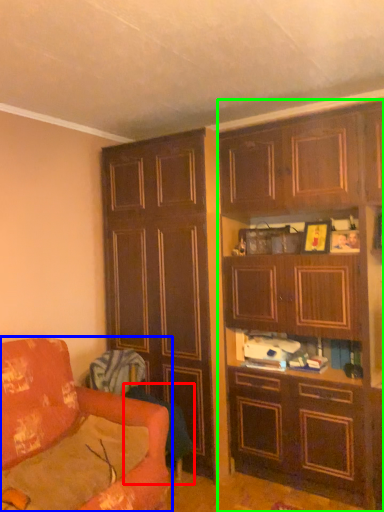
Question: Based on their relative distances, which object is nearer to swivel chair (highlighted by a red box)? Choose from studio couch (highlighted by a blue box) and cabinetry (highlighted by a green box).

Choices:
 (A) studio couch
 (B) cabinetry

Answer: (A)